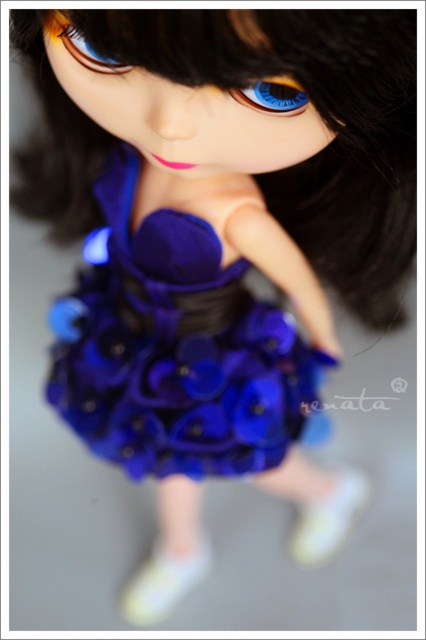
Based on the description of the doll, which object is taller when comparing the satin royal blue dress at center and the blue glossy eye at center?

The satin royal blue dress at center is taller than the blue glossy eye at center according to the description.

You are a fashion designer who wants to place a new accessory between the white fabric shoe at lower right and the white matte socks at lower center. Given that the accessory requires 10 inches of space, will there be enough room?

The distance between the white fabric shoe at lower right and the white matte socks at lower center is 9.56 inches, which is less than the required 10 inches. Therefore, there is not enough space to place the accessory between them.

You are a fashion designer who wants to place a necklace between the satin royal blue dress at center and the blue glossy eye at center. The necklace requires a minimum of 50 centimeters of space to be placed comfortably. Can the necklace fit between them?

The satin royal blue dress at center is 47.13 centimeters from blue glossy eye at center. Since the required space is 50 centimeters, the necklace cannot be placed comfortably between them.